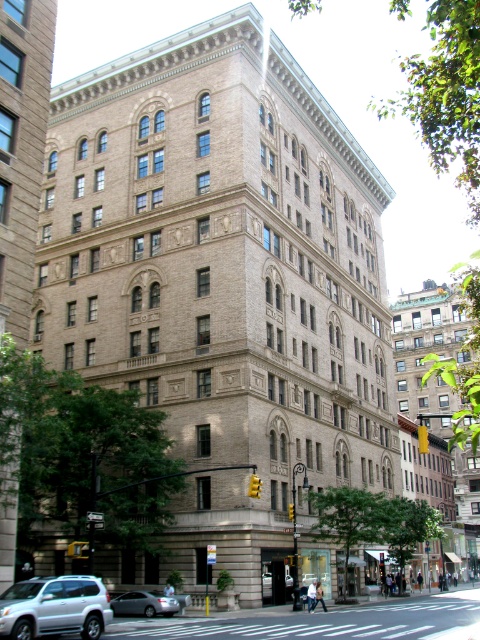
Question: Does silver metallic suv at lower left have a greater width compared to silver metallic sedan at lower center?

Choices:
 (A) no
 (B) yes

Answer: (A)

Question: Which point is farther from the camera taking this photo?

Choices:
 (A) (173, 600)
 (B) (91, 618)

Answer: (A)

Question: Which of the following is the closest to the observer?

Choices:
 (A) silver metallic suv at lower left
 (B) silver metallic sedan at lower center

Answer: (A)

Question: In this image, where is silver metallic suv at lower left located relative to silver metallic sedan at lower center?

Choices:
 (A) left
 (B) right

Answer: (A)

Question: Which point is closer to the camera?

Choices:
 (A) silver metallic sedan at lower center
 (B) silver metallic suv at lower left

Answer: (B)

Question: Is silver metallic suv at lower left closer to the viewer compared to silver metallic sedan at lower center?

Choices:
 (A) no
 (B) yes

Answer: (B)